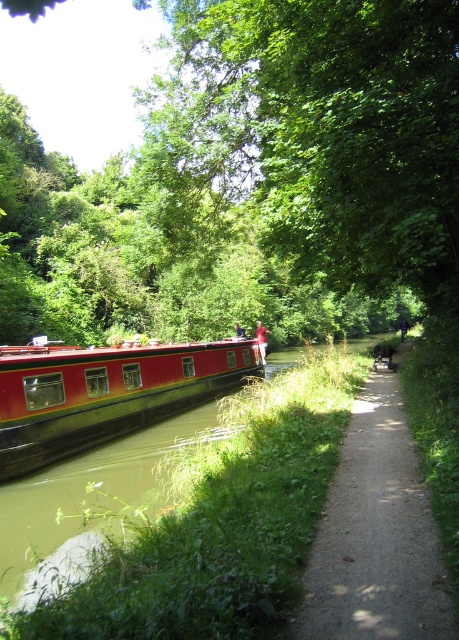
Question: Is red polished wood barge at left to the left of blue denim shirt at center from the viewer's perspective?

Choices:
 (A) yes
 (B) no

Answer: (B)

Question: Which point appears farthest from the camera in this image?

Choices:
 (A) (238, 330)
 (B) (259, 340)
 (C) (395, 570)

Answer: (A)

Question: Which of the following is the closest to the observer?

Choices:
 (A) red polished wood barge at left
 (B) green leafy tree at center
 (C) dirt path at center
 (D) blue denim shirt at center

Answer: (C)

Question: From the image, what is the correct spatial relationship of dirt path at center in relation to red fabric person at center?

Choices:
 (A) left
 (B) right

Answer: (B)

Question: Which point is closer to the camera taking this photo?

Choices:
 (A) (258, 326)
 (B) (51, 428)
 (C) (334, 246)

Answer: (B)

Question: Is green leafy tree at center thinner than red fabric person at center?

Choices:
 (A) yes
 (B) no

Answer: (B)